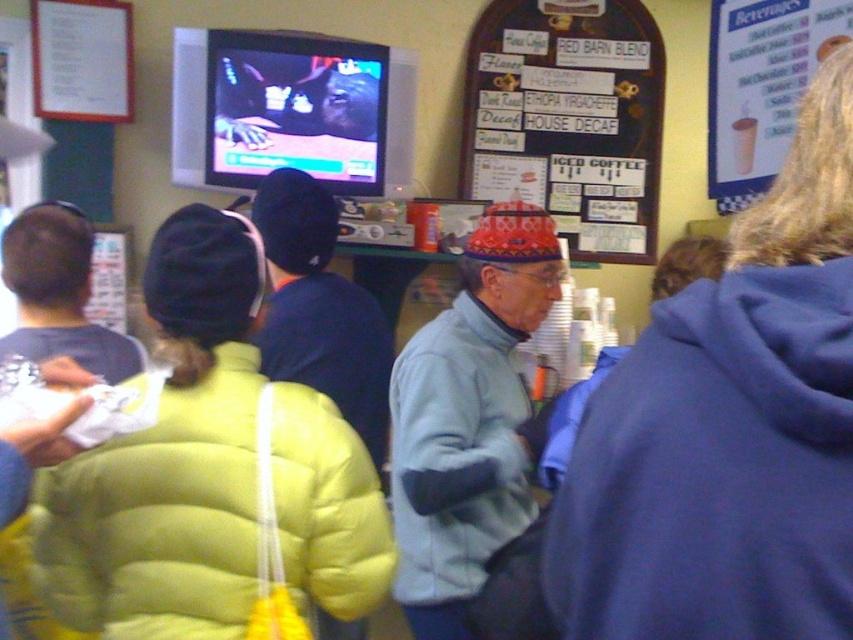
Question: Does light blue fleece jacket at center appear on the left side of wooden signboard at upper center?

Choices:
 (A) no
 (B) yes

Answer: (B)

Question: Which object is closer to the camera taking this photo?

Choices:
 (A) blue fleece jacket at right
 (B) matte blue shirt at left

Answer: (A)

Question: Where is yellow puffer jacket at center located in relation to light blue jacket at center in the image?

Choices:
 (A) right
 (B) left

Answer: (B)

Question: Can you confirm if blue fleece jacket at right is smaller than light blue jacket at center?

Choices:
 (A) no
 (B) yes

Answer: (B)

Question: Which of the following is the farthest from the observer?

Choices:
 (A) (431, 636)
 (B) (142, 461)
 (C) (584, 196)

Answer: (C)

Question: Which object is the farthest from the blue fleece jacket at right?

Choices:
 (A) matte blue shirt at left
 (B) light blue fleece jacket at center
 (C) yellow puffer jacket at center
 (D) wooden signboard at upper center

Answer: (D)